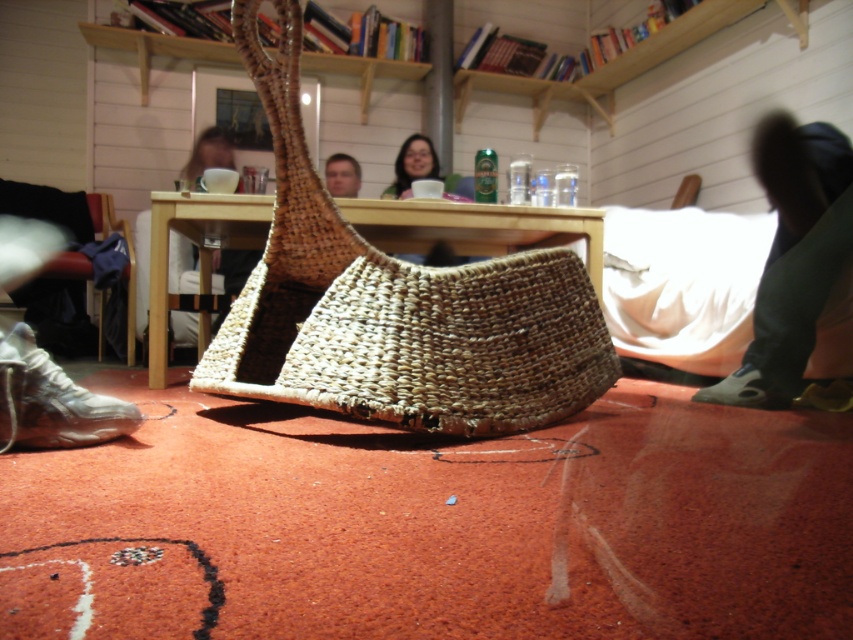
You are setting up a small table for a tea ceremony. You have a matte white cup at center and a black leather shoe at lower right. Which object should you place closer to the edge of the table to ensure stability?

The black leather shoe at lower right should be placed closer to the edge of the table because it is narrower than the matte white cup at center, which might be wider and thus more stable when placed centrally.

You are a guest at a gathering and want to place your matte white cup at center on the table without disturbing the dark green fabric pants at lower right. Is the cup currently positioned in a suitable spot for placing it on the table?

The dark green fabric pants at lower right is located below the matte white cup at center, so the cup is above the pants. This means the cup is not blocking the pants and is likely in a suitable spot for placing it on the table without disturbing them.

From the picture: You are standing in the living room and want to move from the point at coordinates point (569, 413) to the point at coordinates point (436, 173). Which direction should you move to reach your destination?

You should move backward because point (569, 413) is in front of point (436, 173), so moving backward will bring you closer to your destination.